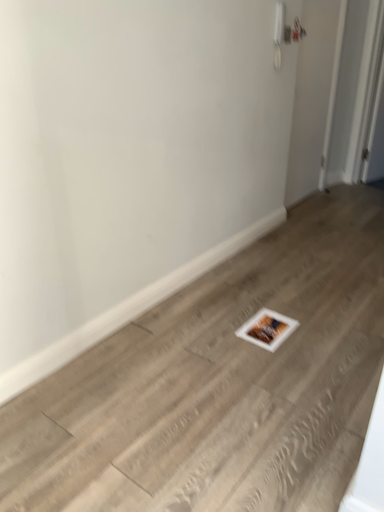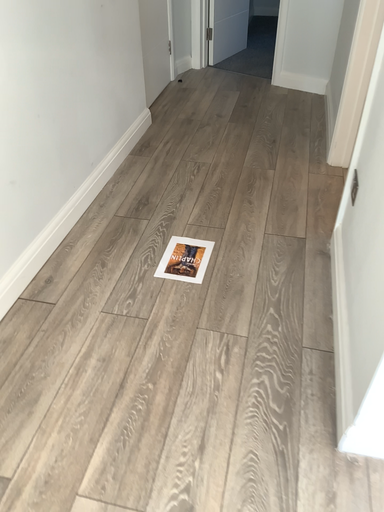
Question: How did the camera likely rotate when shooting the video?

Choices:
 (A) rotated upward
 (B) rotated downward

Answer: (B)